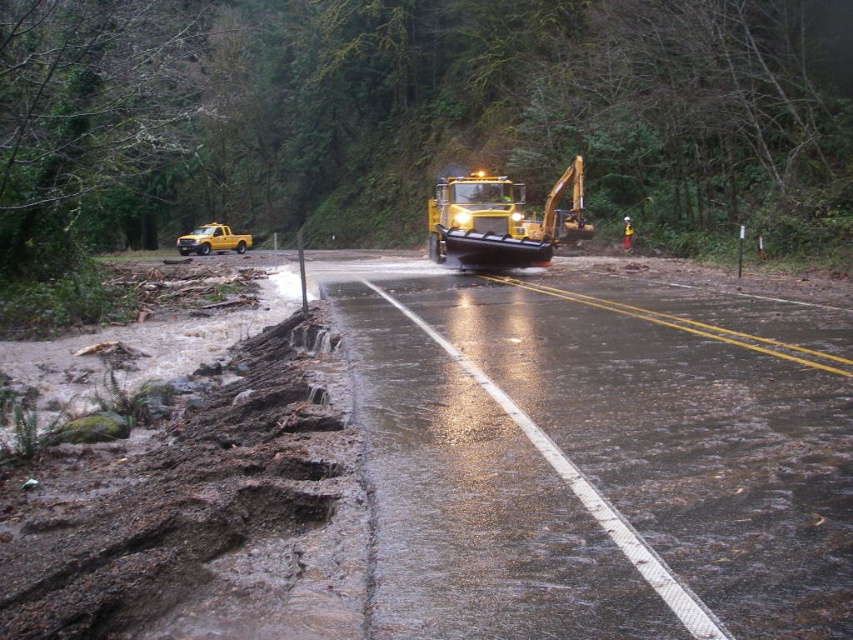
You are a construction worker standing at the edge of the road. You see the yellow rubber excavator at center and the yellow matte truck at left. Which object is closer to you?

The yellow rubber excavator at center is closer to you because it is positioned under the yellow matte truck at left, meaning it is in front of the truck.

You are a construction worker standing near the yellow matte truck at left and looking towards the yellow hard hat at center. Which object is closer to you?

The yellow matte truck at left is closer to you since it is positioned further to the viewer than the yellow hard hat at center, meaning the hard hat is farther away.